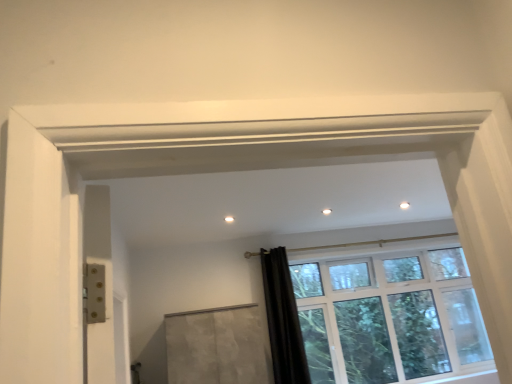
Question: From the image's perspective, does clear glass window at center appear higher than black velvet curtain at lower right?

Choices:
 (A) no
 (B) yes

Answer: (A)

Question: Considering the relative sizes of clear glass window at center and black velvet curtain at lower right in the image provided, is clear glass window at center shorter than black velvet curtain at lower right?

Choices:
 (A) yes
 (B) no

Answer: (B)

Question: Is clear glass window at center behind black velvet curtain at lower right?

Choices:
 (A) no
 (B) yes

Answer: (B)

Question: Does clear glass window at center have a lesser width compared to black velvet curtain at lower right?

Choices:
 (A) yes
 (B) no

Answer: (B)

Question: Can you confirm if clear glass window at center is smaller than black velvet curtain at lower right?

Choices:
 (A) no
 (B) yes

Answer: (A)

Question: Could you tell me if clear glass window at center is turned towards black velvet curtain at lower right?

Choices:
 (A) no
 (B) yes

Answer: (A)

Question: Is matte concrete screen door at center further to the viewer compared to clear glass window at center?

Choices:
 (A) yes
 (B) no

Answer: (B)

Question: From the image's perspective, is matte concrete screen door at center above clear glass window at center?

Choices:
 (A) yes
 (B) no

Answer: (B)

Question: From the image's perspective, would you say matte concrete screen door at center is shown under clear glass window at center?

Choices:
 (A) no
 (B) yes

Answer: (B)

Question: Is matte concrete screen door at center at the left side of clear glass window at center?

Choices:
 (A) no
 (B) yes

Answer: (B)

Question: Does matte concrete screen door at center turn towards clear glass window at center?

Choices:
 (A) no
 (B) yes

Answer: (A)

Question: Is matte concrete screen door at center shorter than clear glass window at center?

Choices:
 (A) yes
 (B) no

Answer: (A)

Question: Would you say black velvet curtain at lower right is part of matte concrete screen door at center's contents?

Choices:
 (A) yes
 (B) no

Answer: (B)